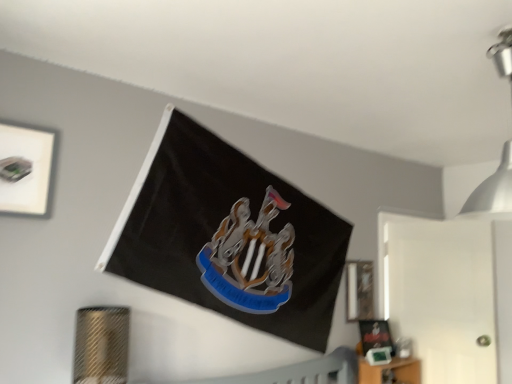
Locate an element on the screen. matte black picture frame at lower right, which appears as the third picture frame when viewed from the left is located at coordinates (375, 335).

The image size is (512, 384). Identify the location of white matte picture frame at upper left, the 3th picture frame when ordered from back to front. (27, 169).

What do you see at coordinates (27, 169) in the screenshot? I see `white matte picture frame at upper left, which is the first picture frame from front to back` at bounding box center [27, 169].

Identify the location of matte black picture frame at lower right, which is the 1th picture frame in right-to-left order. The height and width of the screenshot is (384, 512). pos(375,335).

Which object is further away from the camera, matte black picture frame at right, which is counted as the third picture frame, starting from the front, or metallic silver light fixture at upper right?

matte black picture frame at right, which is counted as the third picture frame, starting from the front.

Who is taller, matte black picture frame at right, acting as the 2th picture frame starting from the left, or metallic silver light fixture at upper right?

metallic silver light fixture at upper right.

Can you tell me how much matte black picture frame at right, which is the 2th picture frame in top-to-bottom order, and metallic silver light fixture at upper right differ in facing direction?

The angle between the facing direction of matte black picture frame at right, which is the 2th picture frame in top-to-bottom order, and the facing direction of metallic silver light fixture at upper right is 6.57 degrees.

Is matte black picture frame at right, the 2th picture frame ordered from the bottom, bigger than metallic silver light fixture at upper right?

Incorrect, matte black picture frame at right, the 2th picture frame ordered from the bottom, is not larger than metallic silver light fixture at upper right.

Does point (384, 324) appear closer or farther from the camera than point (473, 200)?

Clearly, point (384, 324) is more distant from the camera than point (473, 200).

Considering the sizes of matte black picture frame at lower right, which appears as the third picture frame when viewed from the left, and metallic silver light fixture at upper right in the image, is matte black picture frame at lower right, which appears as the third picture frame when viewed from the left, taller or shorter than metallic silver light fixture at upper right?

Considering their sizes, matte black picture frame at lower right, which appears as the third picture frame when viewed from the left, has less height than metallic silver light fixture at upper right.

Is matte black picture frame at lower right, which is the 2th picture frame from front to back, in contact with metallic silver light fixture at upper right?

No, matte black picture frame at lower right, which is the 2th picture frame from front to back, is not in contact with metallic silver light fixture at upper right.

Is matte black picture frame at lower right, the second picture frame from the back, surrounding metallic silver light fixture at upper right?

Actually, metallic silver light fixture at upper right is outside matte black picture frame at lower right, the second picture frame from the back.

Is matte black picture frame at lower right, which is the 1th picture frame in right-to-left order, oriented away from white matte picture frame at upper left, the 3th picture frame when ordered from back to front?

No, matte black picture frame at lower right, which is the 1th picture frame in right-to-left order, is not facing away from white matte picture frame at upper left, the 3th picture frame when ordered from back to front.

Measure the distance between matte black picture frame at lower right, which appears as the third picture frame when viewed from the left, and white matte picture frame at upper left, which ranks as the 3th picture frame in right-to-left order.

A distance of 7.33 feet exists between matte black picture frame at lower right, which appears as the third picture frame when viewed from the left, and white matte picture frame at upper left, which ranks as the 3th picture frame in right-to-left order.

Which object is thinner, matte black picture frame at lower right, the third picture frame from the top, or white matte picture frame at upper left, arranged as the first picture frame when viewed from the top?

white matte picture frame at upper left, arranged as the first picture frame when viewed from the top.

From a real-world perspective, starting from the white matte picture frame at upper left, which is the 3th picture frame from bottom to top, which picture frame is the 2nd one below it? Please provide its 2D coordinates.

[(375, 335)]

Can you confirm if metallic silver light fixture at upper right is shorter than white matte picture frame at upper left, arranged as the first picture frame when viewed from the top?

Incorrect, the height of metallic silver light fixture at upper right does not fall short of that of white matte picture frame at upper left, arranged as the first picture frame when viewed from the top.

From a real-world perspective, between metallic silver light fixture at upper right and white matte picture frame at upper left, which ranks as the 3th picture frame in right-to-left order, who is vertically higher?

metallic silver light fixture at upper right is physically above.

Is there a large distance between metallic silver light fixture at upper right and white matte picture frame at upper left, which is the 3th picture frame from bottom to top?

Yes, metallic silver light fixture at upper right and white matte picture frame at upper left, which is the 3th picture frame from bottom to top, are located far from each other.

Is metallic silver light fixture at upper right aimed at white matte picture frame at upper left, which is the first picture frame from front to back?

No, metallic silver light fixture at upper right is not turned towards white matte picture frame at upper left, which is the first picture frame from front to back.

Are metallic silver light fixture at upper right and matte black picture frame at lower right, the third picture frame from the top, making contact?

No, metallic silver light fixture at upper right is not beside matte black picture frame at lower right, the third picture frame from the top.

Is point (503, 174) farther from viewer compared to point (383, 322)?

No.

What's the angular difference between metallic silver light fixture at upper right and matte black picture frame at lower right, the second picture frame from the back,'s facing directions?

25.1 degrees separate the facing orientations of metallic silver light fixture at upper right and matte black picture frame at lower right, the second picture frame from the back.

Which of these two, metallic silver light fixture at upper right or matte black picture frame at lower right, which is the 1th picture frame in right-to-left order, is bigger?

metallic silver light fixture at upper right.

In the image, is metallic silver light fixture at upper right on the left side or the right side of matte black picture frame at right, the 2th picture frame ordered from the bottom?

metallic silver light fixture at upper right is to the right of matte black picture frame at right, the 2th picture frame ordered from the bottom.

Is metallic silver light fixture at upper right not within matte black picture frame at right, which is the 2th picture frame in top-to-bottom order?

metallic silver light fixture at upper right is positioned outside matte black picture frame at right, which is the 2th picture frame in top-to-bottom order.

Is metallic silver light fixture at upper right next to matte black picture frame at right, positioned as the first picture frame in back-to-front order, and touching it?

No, metallic silver light fixture at upper right is not making contact with matte black picture frame at right, positioned as the first picture frame in back-to-front order.

Between white matte picture frame at upper left, the first picture frame when ordered from left to right, and matte black picture frame at right, which is counted as the third picture frame, starting from the front, which one has smaller width?

matte black picture frame at right, which is counted as the third picture frame, starting from the front.

In the scene shown: Is white matte picture frame at upper left, which is the 3th picture frame from bottom to top, far away from matte black picture frame at right, positioned as the first picture frame in back-to-front order?

That's right, there is a large distance between white matte picture frame at upper left, which is the 3th picture frame from bottom to top, and matte black picture frame at right, positioned as the first picture frame in back-to-front order.

Could you tell me if white matte picture frame at upper left, the first picture frame when ordered from left to right, is facing matte black picture frame at right, which is the 2th picture frame in top-to-bottom order?

No, white matte picture frame at upper left, the first picture frame when ordered from left to right, does not turn towards matte black picture frame at right, which is the 2th picture frame in top-to-bottom order.

Could you measure the distance between white matte picture frame at upper left, the 3th picture frame when ordered from back to front, and matte black picture frame at right, positioned as the first picture frame in back-to-front order?

They are 6.78 feet apart.

Where is `light fixture that is on the right side of matte black picture frame at right, acting as the 2th picture frame starting from the left`? This screenshot has height=384, width=512. light fixture that is on the right side of matte black picture frame at right, acting as the 2th picture frame starting from the left is located at coordinates tap(494, 188).

Where is `light fixture in front of the matte black picture frame at lower right, which appears as the third picture frame when viewed from the left`? light fixture in front of the matte black picture frame at lower right, which appears as the third picture frame when viewed from the left is located at coordinates coord(494,188).

Which object lies further to the anchor point metallic silver light fixture at upper right, matte black picture frame at right, positioned as the first picture frame in back-to-front order, or matte black picture frame at lower right, the third picture frame from the top?

matte black picture frame at lower right, the third picture frame from the top, is positioned further to the anchor metallic silver light fixture at upper right.

From the image, which object appears to be nearer to white matte picture frame at upper left, arranged as the first picture frame when viewed from the top, metallic silver light fixture at upper right or matte black picture frame at lower right, which is the 1th picture frame in right-to-left order?

The object closer to white matte picture frame at upper left, arranged as the first picture frame when viewed from the top, is metallic silver light fixture at upper right.

From the image, which object appears to be nearer to matte black picture frame at right, which is the 2th picture frame in top-to-bottom order, metallic silver light fixture at upper right or matte black picture frame at lower right, which is the 2th picture frame from front to back?

matte black picture frame at lower right, which is the 2th picture frame from front to back.

Estimate the real-world distances between objects in this image. Which object is closer to white matte picture frame at upper left, the 3th picture frame when ordered from back to front, matte black picture frame at right, positioned as the 2th picture frame in right-to-left order, or metallic silver light fixture at upper right?

Based on the image, metallic silver light fixture at upper right appears to be nearer to white matte picture frame at upper left, the 3th picture frame when ordered from back to front.

From the picture: Estimate the real-world distances between objects in this image. Which object is closer to white matte picture frame at upper left, the 3th picture frame when ordered from back to front, matte black picture frame at right, positioned as the 2th picture frame in right-to-left order, or matte black picture frame at lower right, which is the 2th picture frame from front to back?

Based on the image, matte black picture frame at right, positioned as the 2th picture frame in right-to-left order, appears to be nearer to white matte picture frame at upper left, the 3th picture frame when ordered from back to front.

Looking at this image, from the image, which object appears to be farther from matte black picture frame at right, acting as the 2th picture frame starting from the left, white matte picture frame at upper left, the first picture frame when ordered from left to right, or metallic silver light fixture at upper right?

Based on the image, white matte picture frame at upper left, the first picture frame when ordered from left to right, appears to be further to matte black picture frame at right, acting as the 2th picture frame starting from the left.

Which object lies nearer to the anchor point white matte picture frame at upper left, which is the first picture frame from front to back, matte black picture frame at lower right, which is the 2th picture frame from front to back, or matte black picture frame at right, which is counted as the third picture frame, starting from the front?

Among the two, matte black picture frame at right, which is counted as the third picture frame, starting from the front, is located nearer to white matte picture frame at upper left, which is the first picture frame from front to back.

Based on their spatial positions, is metallic silver light fixture at upper right or white matte picture frame at upper left, which is the first picture frame from front to back, further from matte black picture frame at lower right, which is the 2th picture frame from front to back?

white matte picture frame at upper left, which is the first picture frame from front to back, is further to matte black picture frame at lower right, which is the 2th picture frame from front to back.

I want to click on picture frame between white matte picture frame at upper left, which ranks as the 3th picture frame in right-to-left order, and matte black picture frame at lower right, which is the 2th picture frame from front to back, in the horizontal direction, so click(359, 290).